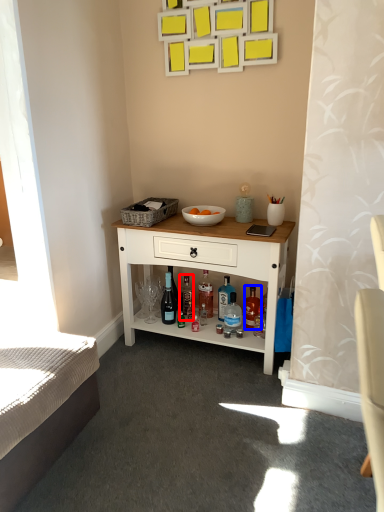
Question: Among these objects, which one is nearest to the camera, bottle (highlighted by a red box) or bottle (highlighted by a blue box)?

Choices:
 (A) bottle
 (B) bottle

Answer: (B)